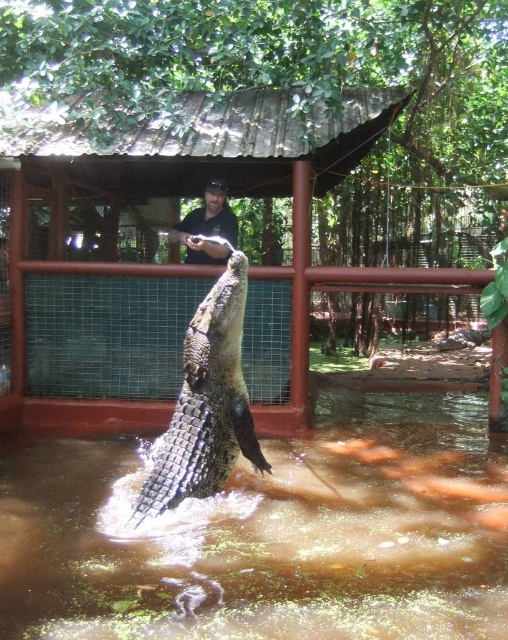
Measure the distance between brown murky water at center and camera.

brown murky water at center and camera are 2.63 meters apart from each other.

Who is positioned more to the left, brown murky water at center or shiny brown crocodile at center?

shiny brown crocodile at center

Which is in front, point (341, 428) or point (204, 356)?

Point (204, 356) is more forward.

At what (x,y) coordinates should I click in order to perform the action: click on brown murky water at center. Please return your answer as a coordinate pair (x, y). The height and width of the screenshot is (640, 508). Looking at the image, I should click on tap(270, 536).

Does brown murky water at center appear under black matte shirt at upper center?

Yes, brown murky water at center is below black matte shirt at upper center.

Is point (262, 595) positioned behind point (205, 200)?

No.

Locate an element on the screen. This screenshot has height=640, width=508. brown murky water at center is located at coordinates (270, 536).

Is shiny brown crocodile at center shorter than black matte shirt at upper center?

No, shiny brown crocodile at center is not shorter than black matte shirt at upper center.

Which is behind, point (194, 440) or point (194, 218)?

The point (194, 218) is more distant.

Find the location of a particular element. The image size is (508, 640). shiny brown crocodile at center is located at coordinates (206, 404).